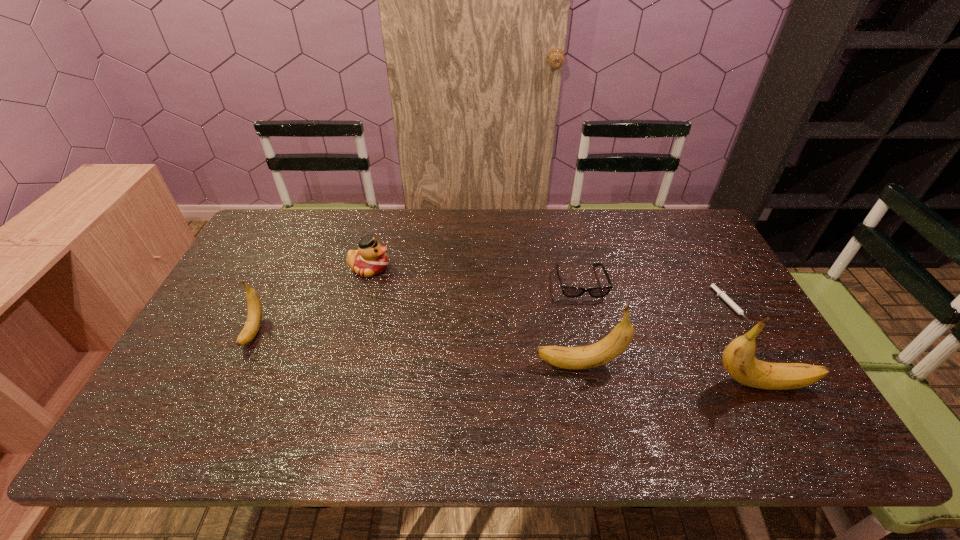
I want to click on vacant region that satisfies the following two spatial constraints: 1. on the back side of the syringe; 2. on the face of the fifth object from right to left, so click(x=708, y=268).

The height and width of the screenshot is (540, 960). In order to click on vacant point that satisfies the following two spatial constraints: 1. on the back side of the shortest object; 2. on the face of the fifth object from right to left in this screenshot , I will do `click(708, 268)`.

Where is `free space that satisfies the following two spatial constraints: 1. on the face of the second object from left to right; 2. at the start of the peel on the leftmost object`? The image size is (960, 540). free space that satisfies the following two spatial constraints: 1. on the face of the second object from left to right; 2. at the start of the peel on the leftmost object is located at coordinates (352, 331).

This screenshot has width=960, height=540. I want to click on blank space that satisfies the following two spatial constraints: 1. on the lenses of the spectacles; 2. on the right side of the shortest object, so click(586, 306).